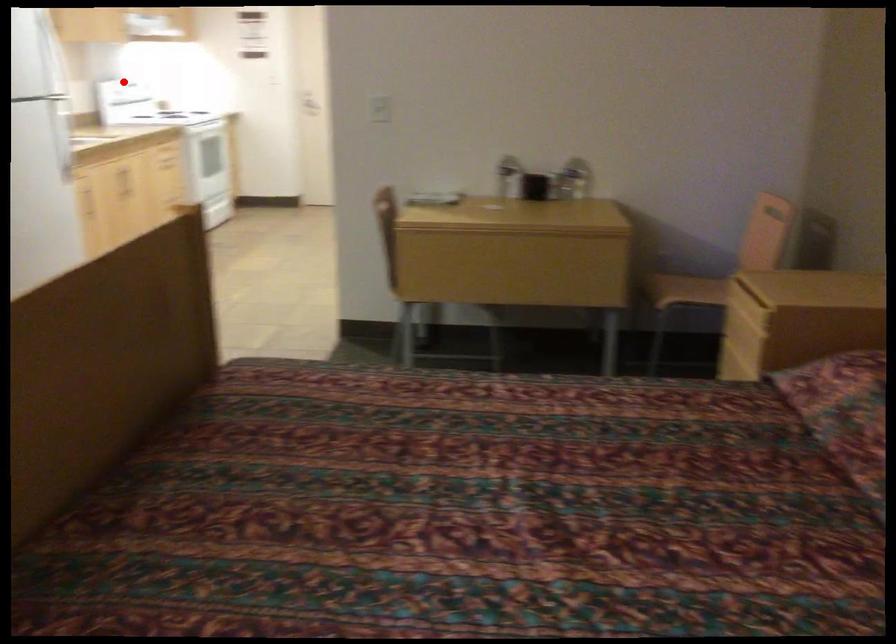
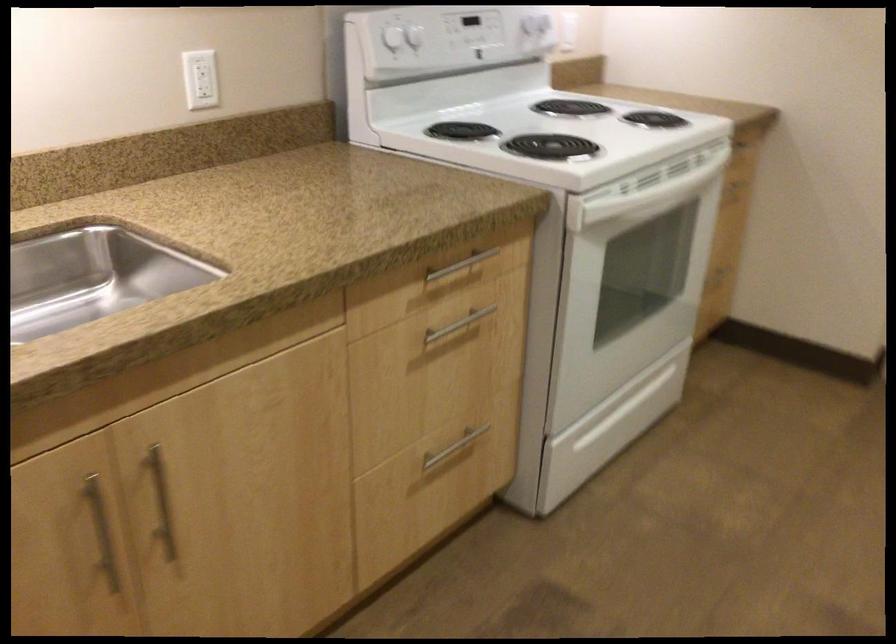
Question: I am providing you with two images of the same scene from different viewpoints. Given a red point in image1, look at the same physical point in image2. Is it:

Choices:
 (A) Closer to the viewpoint
 (B) Farther from the viewpoint

Answer: (A)